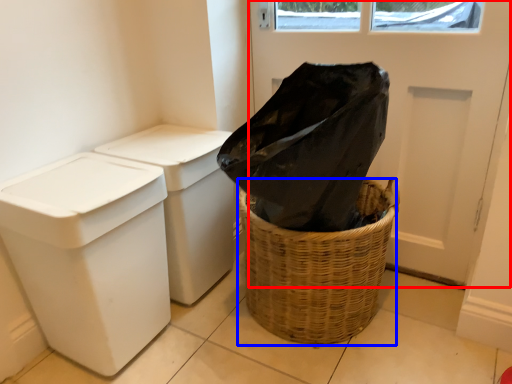
Question: Which of the following is the farthest to the observer, screen door (highlighted by a red box) or basket container (highlighted by a blue box)?

Choices:
 (A) screen door
 (B) basket container

Answer: (A)